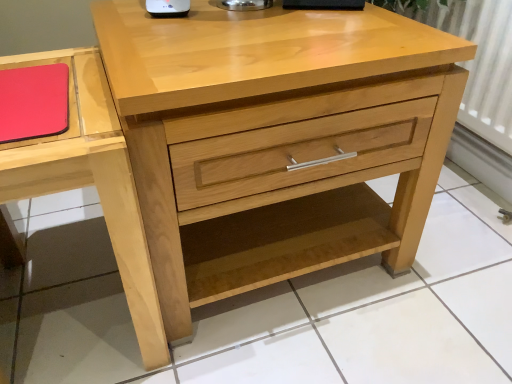
Question: Could you tell me if matte wood vanity at left is turned towards rubberized matte red notepad at upper left?

Choices:
 (A) no
 (B) yes

Answer: (A)

Question: From a real-world perspective, is matte wood vanity at left physically below rubberized matte red notepad at upper left?

Choices:
 (A) no
 (B) yes

Answer: (B)

Question: Is matte wood vanity at left behind rubberized matte red notepad at upper left?

Choices:
 (A) no
 (B) yes

Answer: (A)

Question: Is matte wood vanity at left looking in the opposite direction of rubberized matte red notepad at upper left?

Choices:
 (A) yes
 (B) no

Answer: (B)

Question: Does matte wood vanity at left have a greater width compared to rubberized matte red notepad at upper left?

Choices:
 (A) yes
 (B) no

Answer: (A)

Question: Does matte wood vanity at left lie in front of rubberized matte red notepad at upper left?

Choices:
 (A) yes
 (B) no

Answer: (A)

Question: Does natural wood chest of drawers at center have a lesser width compared to rubberized matte red notepad at upper left?

Choices:
 (A) no
 (B) yes

Answer: (A)

Question: Is natural wood chest of drawers at center closer to the viewer compared to rubberized matte red notepad at upper left?

Choices:
 (A) no
 (B) yes

Answer: (B)

Question: Is natural wood chest of drawers at center aimed at rubberized matte red notepad at upper left?

Choices:
 (A) yes
 (B) no

Answer: (B)

Question: Does natural wood chest of drawers at center have a greater height compared to rubberized matte red notepad at upper left?

Choices:
 (A) no
 (B) yes

Answer: (B)

Question: From the image's perspective, does natural wood chest of drawers at center appear higher than rubberized matte red notepad at upper left?

Choices:
 (A) no
 (B) yes

Answer: (A)

Question: Does natural wood chest of drawers at center have a lesser height compared to rubberized matte red notepad at upper left?

Choices:
 (A) no
 (B) yes

Answer: (A)

Question: Considering the relative positions of rubberized matte red notepad at upper left and natural wood chest of drawers at center in the image provided, is rubberized matte red notepad at upper left in front of natural wood chest of drawers at center?

Choices:
 (A) no
 (B) yes

Answer: (A)